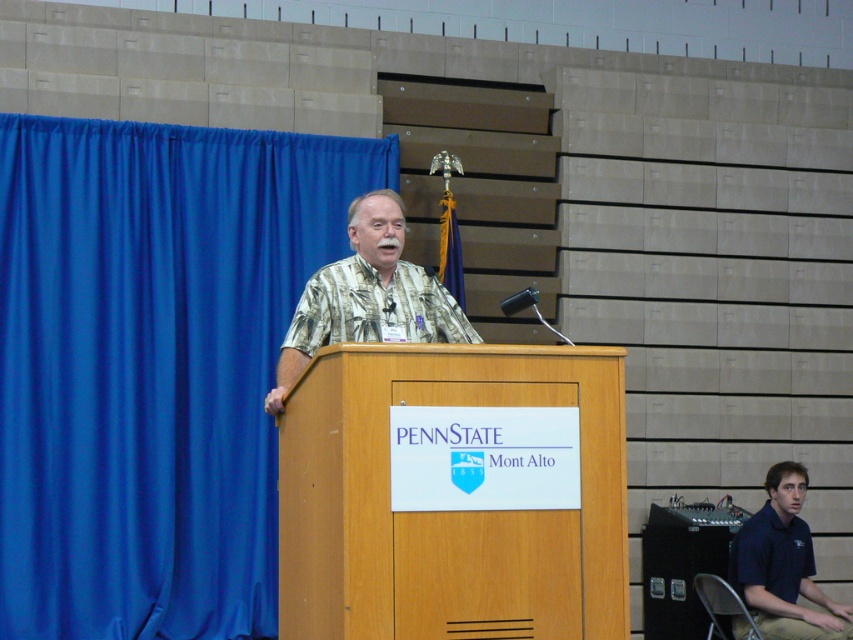
Question: Among these points, which one is farthest from the camera?

Choices:
 (A) (x=459, y=538)
 (B) (x=26, y=563)

Answer: (B)

Question: Which object is the closest to the dark blue shirt at lower right?

Choices:
 (A) wooden podium at center
 (B) printed fabric shirt at center

Answer: (B)

Question: Does printed fabric shirt at center have a larger size compared to dark blue shirt at lower right?

Choices:
 (A) yes
 (B) no

Answer: (B)

Question: Does wooden podium at center appear on the right side of printed fabric shirt at center?

Choices:
 (A) yes
 (B) no

Answer: (A)

Question: Is printed fabric shirt at center below dark blue shirt at lower right?

Choices:
 (A) yes
 (B) no

Answer: (B)

Question: Which point is closer to the camera?

Choices:
 (A) blue fabric curtain at left
 (B) black plastic speaker at lower right
 (C) dark blue shirt at lower right

Answer: (C)